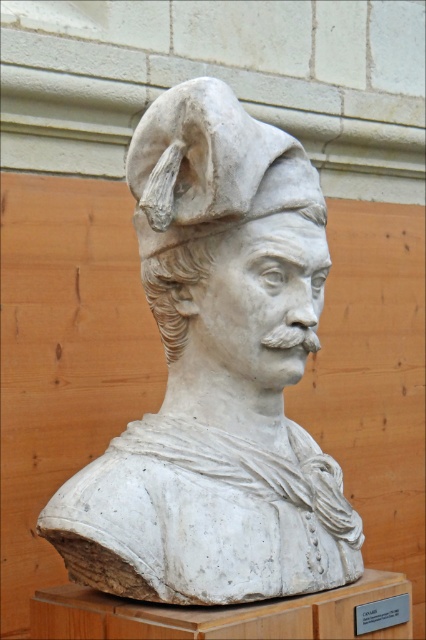
Question: Is white stone bust at center further to camera compared to white marble bust at center?

Choices:
 (A) no
 (B) yes

Answer: (A)

Question: Among these points, which one is nearest to the camera?

Choices:
 (A) (166, 182)
 (B) (163, 560)

Answer: (B)

Question: In this image, where is white stone bust at center located relative to white marble bust at center?

Choices:
 (A) below
 (B) above

Answer: (A)

Question: Which point is farther to the camera?

Choices:
 (A) white marble bust at center
 (B) white stone bust at center

Answer: (A)

Question: Observing the image, what is the correct spatial positioning of white stone bust at center in reference to white marble bust at center?

Choices:
 (A) right
 (B) left

Answer: (A)

Question: Which of the following is the closest to the observer?

Choices:
 (A) white stone bust at center
 (B) white marble bust at center

Answer: (A)